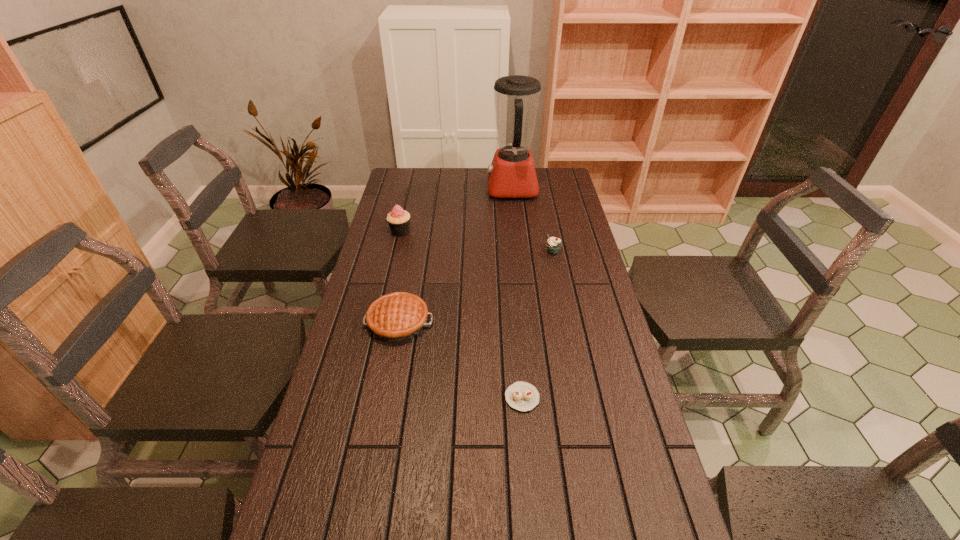
This screenshot has height=540, width=960. I want to click on vacant region that satisfies the following two spatial constraints: 1. on the front side of the pie; 2. on the right side of the leftmost cupcake, so click(379, 322).

Identify the location of vacant space that satisfies the following two spatial constraints: 1. on the front side of the leftmost cupcake; 2. on the right side of the third nearest object. This screenshot has width=960, height=540. (396, 252).

Locate an element on the screen. This screenshot has width=960, height=540. vacant space that satisfies the following two spatial constraints: 1. on the front of the blender near the controls; 2. on the front side of the nearest cupcake is located at coordinates (535, 397).